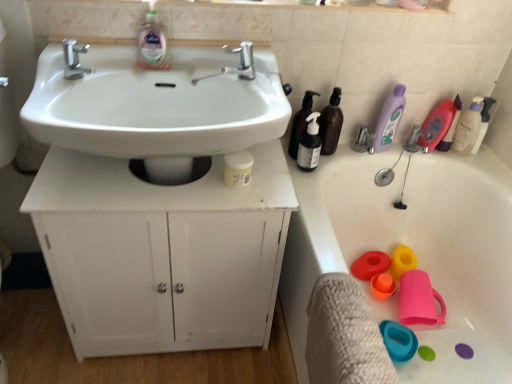
Where is `free space in front of white matte jar at center, which ranks as the 1th toiletry in left-to-right order`? This screenshot has height=384, width=512. free space in front of white matte jar at center, which ranks as the 1th toiletry in left-to-right order is located at coordinates (228, 200).